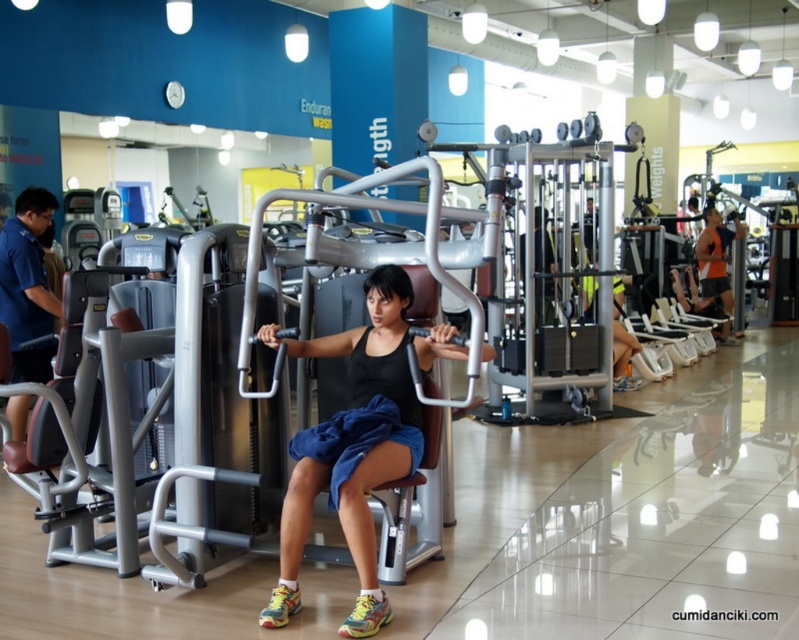
You are standing in the gym and want to move from the point at coordinates point (384, 438) to the point at coordinates point (700, 282). Which direction should you move in to reach the second point?

You should move towards the lower right direction because point (700, 282) is further away from the camera compared to point (384, 438).

You are a gym member who wants to pick up a shirt that is closer to you. Which one should you choose between the blue fabric shirt at left and the orange mesh tank top at center?

The blue fabric shirt at left is closer to the viewer than the orange mesh tank top at center, so you should choose the blue fabric shirt at left.

What are the coordinates of the black matte tank top at center?

The coordinates of the black matte tank top at center are at point (356,442).